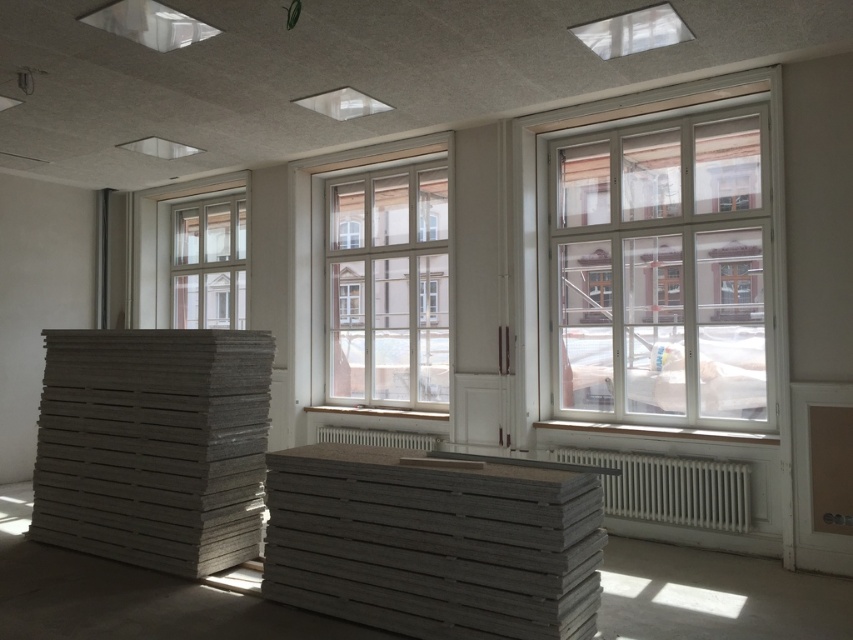
Question: Which point is closer to the camera?

Choices:
 (A) (163, 541)
 (B) (354, 401)
 (C) (486, 540)

Answer: (C)

Question: Observing the image, what is the correct spatial positioning of gray matte lumber at left in reference to clear glass window at upper left?

Choices:
 (A) above
 (B) below

Answer: (B)

Question: Does white metallic radiator at center appear under gray matte palette at center?

Choices:
 (A) no
 (B) yes

Answer: (B)

Question: Among these points, which one is nearest to the camera?

Choices:
 (A) 332,436
 (B) 747,106

Answer: (B)

Question: Which object is farther from the camera taking this photo?

Choices:
 (A) clear glass window at upper left
 (B) white metallic radiator at center
 (C) white glass window at center

Answer: (A)

Question: Can you confirm if white glass window at right is positioned above white metallic radiator at center?

Choices:
 (A) no
 (B) yes

Answer: (B)